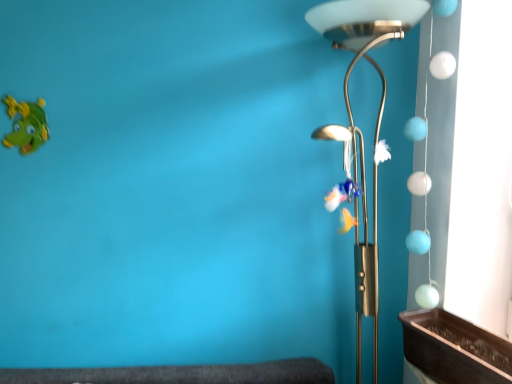
Identify the location of green matte toy at upper left. (26, 125).

This screenshot has width=512, height=384. What do you see at coordinates (26, 125) in the screenshot?
I see `green matte toy at upper left` at bounding box center [26, 125].

Find the location of `green matte toy at upper left`. green matte toy at upper left is located at coordinates (26, 125).